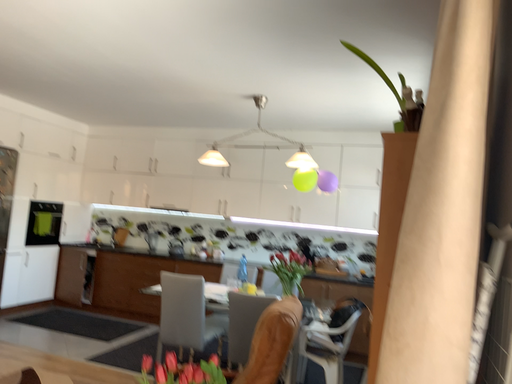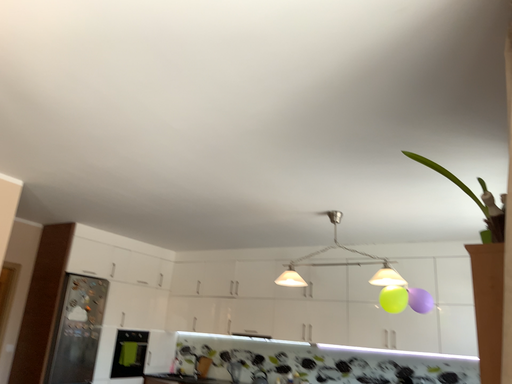
Question: Which way did the camera rotate in the video?

Choices:
 (A) rotated right
 (B) rotated left

Answer: (B)